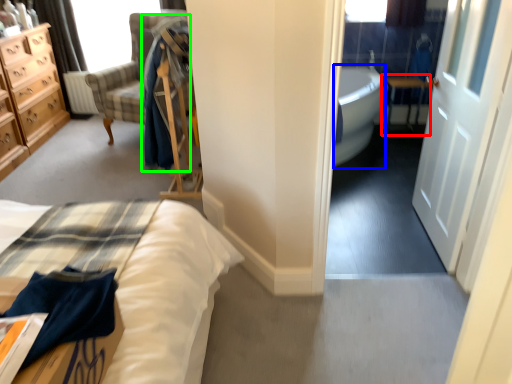
Question: Estimate the real-world distances between objects in this image. Which object is farther from table (highlighted by a red box), bath (highlighted by a blue box) or robe (highlighted by a green box)?

Choices:
 (A) bath
 (B) robe

Answer: (B)